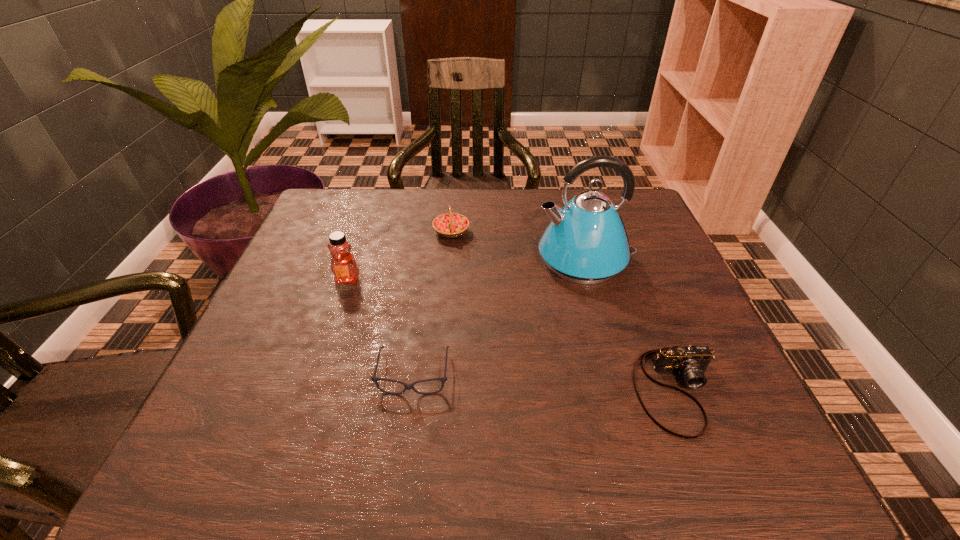
I want to click on vacant area situated on the left of the strawberry, so click(x=368, y=232).

What are the coordinates of `vacant point located 0.070m on the front-facing side of the shortest object` in the screenshot? It's located at (405, 436).

Find the location of a particular element. Image resolution: width=960 pixels, height=540 pixels. kettle that is at the far edge is located at coordinates (586, 242).

You are a GUI agent. You are given a task and a screenshot of the screen. Output one action in this format:
    pyautogui.click(x=<x>, y=<y>)
    Task: Click on the strawberry present at the far edge
    This screenshot has width=960, height=540.
    Given the screenshot: What is the action you would take?
    pyautogui.click(x=450, y=225)

I want to click on object that is at the near edge, so click(x=691, y=362).

You are a GUI agent. You are given a task and a screenshot of the screen. Output one action in this format:
    pyautogui.click(x=<x>, y=<y>)
    Task: Click on the object present at the left edge
    Image resolution: width=960 pixels, height=540 pixels.
    Given the screenshot: What is the action you would take?
    pyautogui.click(x=343, y=265)

This screenshot has width=960, height=540. What are the coordinates of `kettle that is at the right edge` in the screenshot? It's located at (586, 242).

Where is `camera present at the right edge`? The height and width of the screenshot is (540, 960). camera present at the right edge is located at coordinates (691, 362).

Where is `object present at the far right corner`? This screenshot has height=540, width=960. object present at the far right corner is located at coordinates (586, 242).

Image resolution: width=960 pixels, height=540 pixels. In order to click on object that is at the near right corner in this screenshot , I will do `click(691, 362)`.